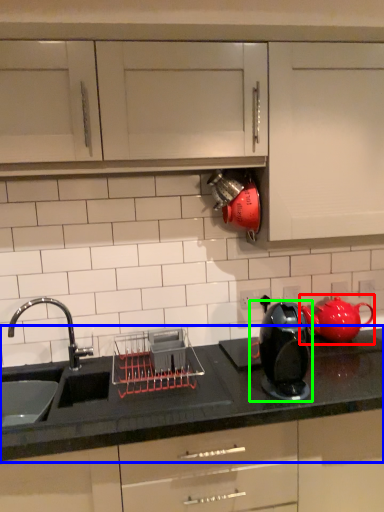
Question: Which object is positioned closest to tea pot (highlighted by a red box)? Select from countertop (highlighted by a blue box) and home appliance (highlighted by a green box).

Choices:
 (A) countertop
 (B) home appliance

Answer: (A)